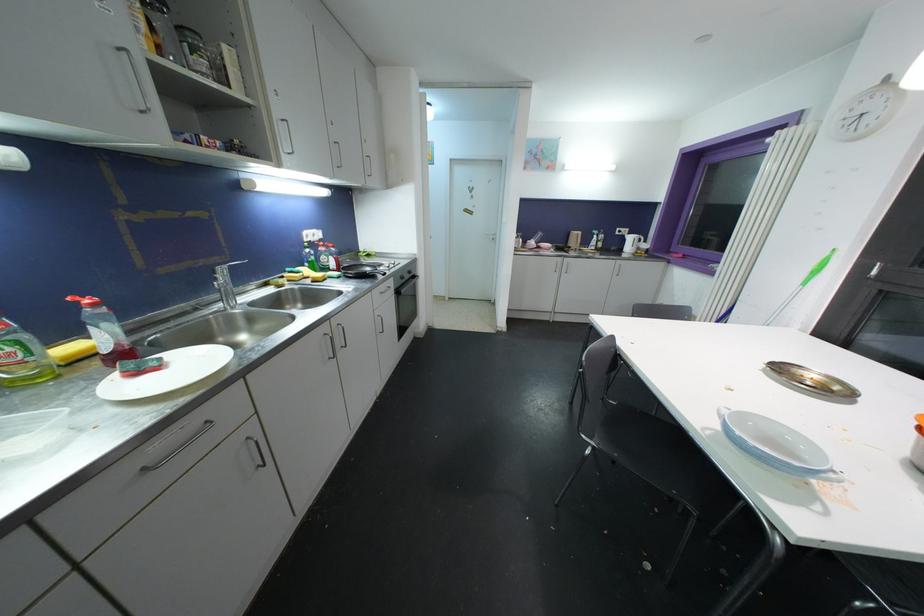
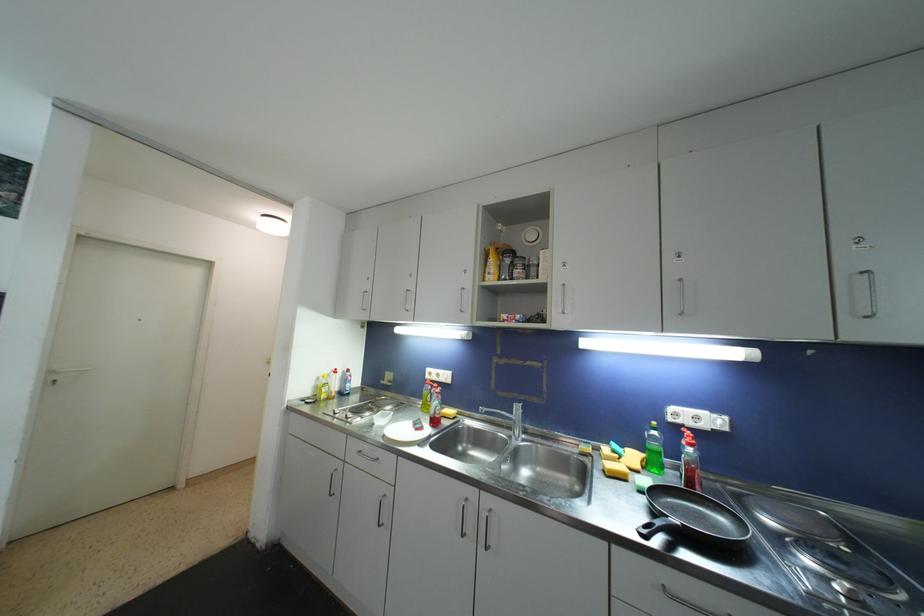
In the second image, find the point that corresponds to (324,252) in the first image.

(687, 445)